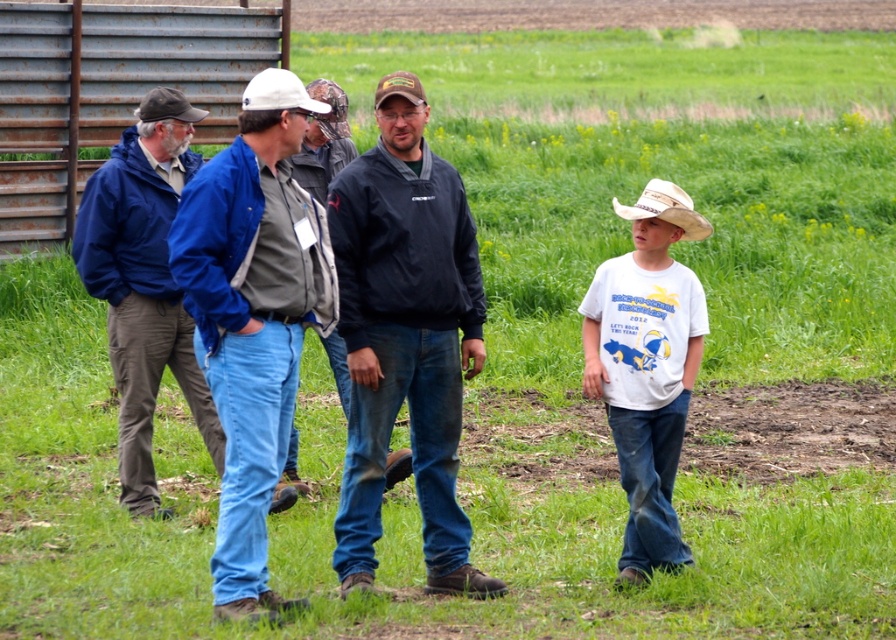
Question: Does white cotton shirt at right appear over blue denim jeans at left?

Choices:
 (A) no
 (B) yes

Answer: (A)

Question: Is dark blue jacket at center thinner than brown fabric cowboy hat at upper left?

Choices:
 (A) yes
 (B) no

Answer: (B)

Question: Which of the following is the closest to the observer?

Choices:
 (A) (283, 92)
 (B) (123, 321)
 (C) (668, 204)
 (D) (164, 109)

Answer: (A)

Question: Which of the following is the farthest from the observer?

Choices:
 (A) 165,349
 (B) 252,84
 (C) 674,422
 (D) 440,445

Answer: (A)

Question: Which object appears farthest from the camera in this image?

Choices:
 (A) white straw hat at right
 (B) brown fabric cowboy hat at upper left
 (C) blue denim jeans at left

Answer: (B)

Question: Is white straw hat at right wider than white matte cowboy hat at center?

Choices:
 (A) yes
 (B) no

Answer: (A)